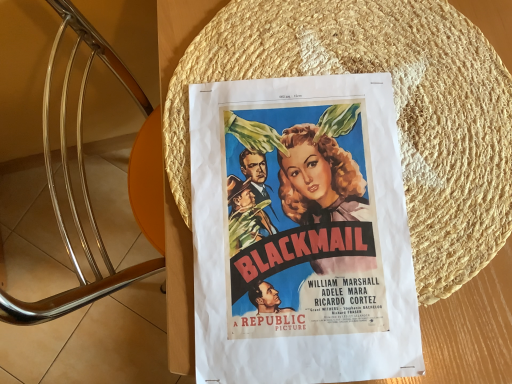
Identify the location of vacant space behind matte paper poster at center. (327, 47).